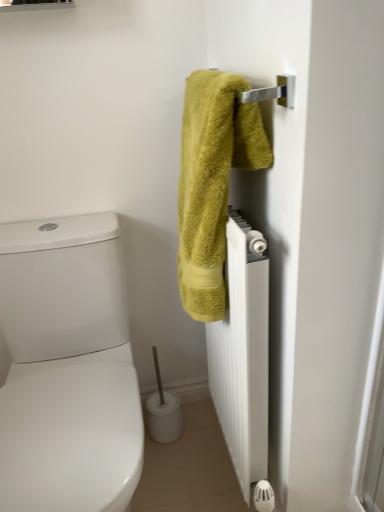
Question: From a real-world perspective, relative to white matte radiator at right, is green fuzzy towel at upper right vertically above or below?

Choices:
 (A) above
 (B) below

Answer: (A)

Question: Is green fuzzy towel at upper right spatially inside white matte radiator at right, or outside of it?

Choices:
 (A) outside
 (B) inside

Answer: (A)

Question: Considering the positions of green fuzzy towel at upper right and white matte radiator at right in the image, is green fuzzy towel at upper right taller or shorter than white matte radiator at right?

Choices:
 (A) short
 (B) tall

Answer: (A)

Question: In terms of height, does white matte radiator at right look taller or shorter compared to green fuzzy towel at upper right?

Choices:
 (A) tall
 (B) short

Answer: (A)

Question: From a real-world perspective, relative to green fuzzy towel at upper right, is white matte radiator at right vertically above or below?

Choices:
 (A) below
 (B) above

Answer: (A)

Question: In terms of width, does white matte radiator at right look wider or thinner when compared to green fuzzy towel at upper right?

Choices:
 (A) wide
 (B) thin

Answer: (B)

Question: Is point (236, 423) positioned closer to the camera than point (215, 289)?

Choices:
 (A) closer
 (B) farther

Answer: (B)